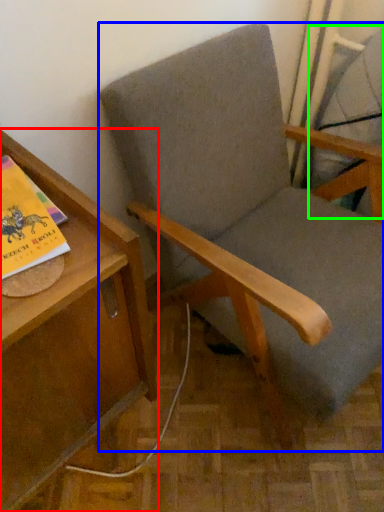
Question: Estimate the real-world distances between objects in this image. Which object is farther from table (highlighted by a red box), chair (highlighted by a blue box) or swivel chair (highlighted by a green box)?

Choices:
 (A) chair
 (B) swivel chair

Answer: (B)